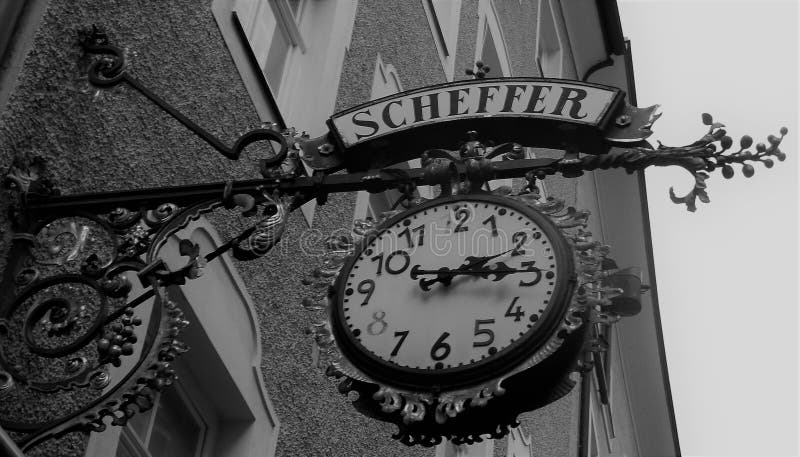
At what (x,y) coordinates should I click in order to perform the action: click on window. Please return your answer as a coordinate pair (x, y). This screenshot has height=457, width=800. Looking at the image, I should click on (252, 60), (212, 385), (545, 52), (498, 59).